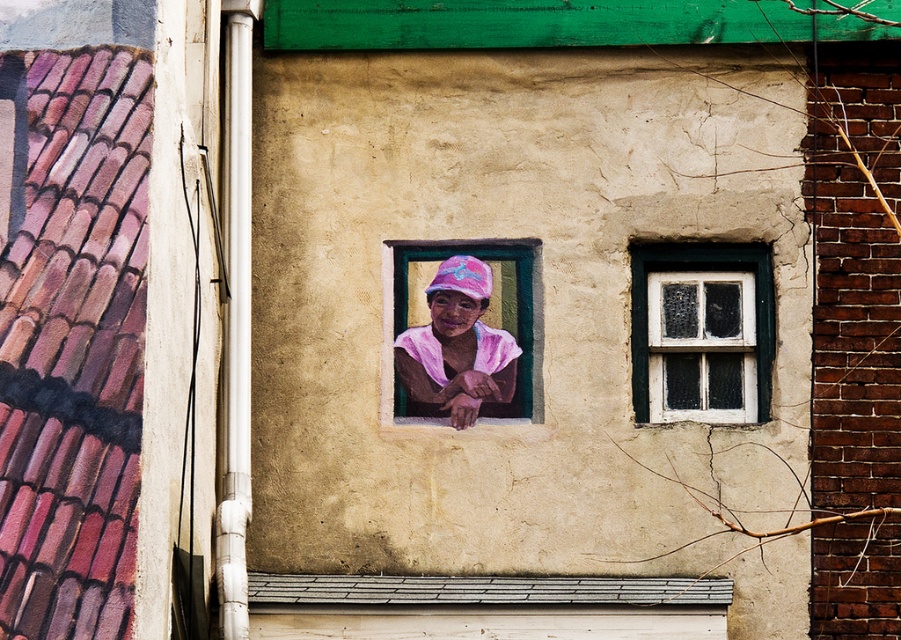
Who is more forward, (475, 339) or (454, 296)?

Point (475, 339) is more forward.

Is the position of pink fabric at center more distant than that of pink matte fabric at center?

No, pink fabric at center is in front of pink matte fabric at center.

Does point (417, 356) come in front of point (470, 298)?

That is True.

The image size is (901, 640). I want to click on pink fabric at center, so click(457, 349).

Locate an element on the screen. The width and height of the screenshot is (901, 640). white painted wood at upper right is located at coordinates (701, 269).

Looking at this image, how much distance is there between white painted wood at upper right and pink matte fabric at center?

They are 33.43 inches apart.

The width and height of the screenshot is (901, 640). Describe the element at coordinates (701, 269) in the screenshot. I see `white painted wood at upper right` at that location.

Find the location of a particular element. This screenshot has width=901, height=640. white painted wood at upper right is located at coordinates (x=701, y=269).

Between pink fabric at center and white painted wood at upper right, which one is positioned lower?

Positioned lower is pink fabric at center.

Between pink fabric at center and white painted wood at upper right, which one is positioned higher?

white painted wood at upper right

Is point (466, 387) positioned before point (681, 269)?

Yes, point (466, 387) is closer to viewer.

You are a GUI agent. You are given a task and a screenshot of the screen. Output one action in this format:
    pyautogui.click(x=<x>, y=<y>)
    Task: Click on the pink fabric at center
    
    Given the screenshot: What is the action you would take?
    pyautogui.click(x=457, y=349)